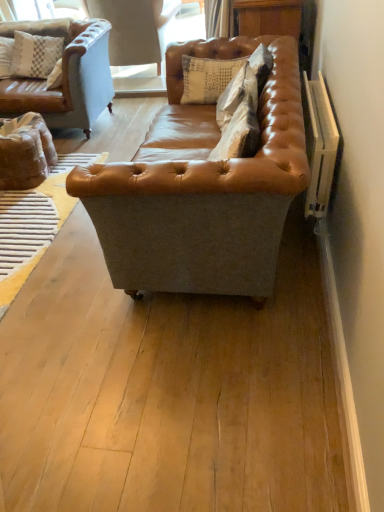
You are a GUI agent. You are given a task and a screenshot of the screen. Output one action in this format:
    pyautogui.click(x=<x>, y=<y>)
    Task: Click on the free space in front of saddle brown leather couch at center
    This screenshot has width=384, height=512.
    Given the screenshot: What is the action you would take?
    pyautogui.click(x=183, y=382)